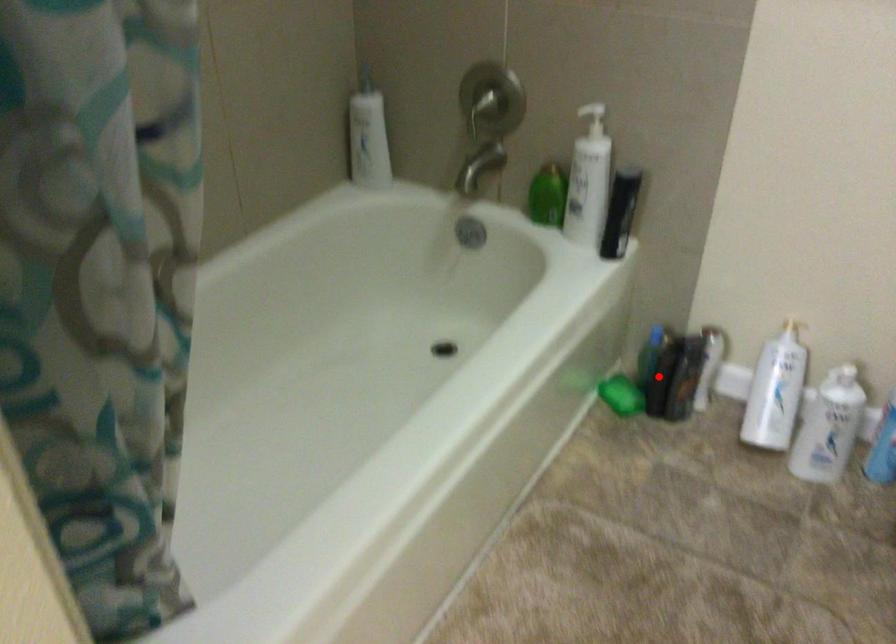
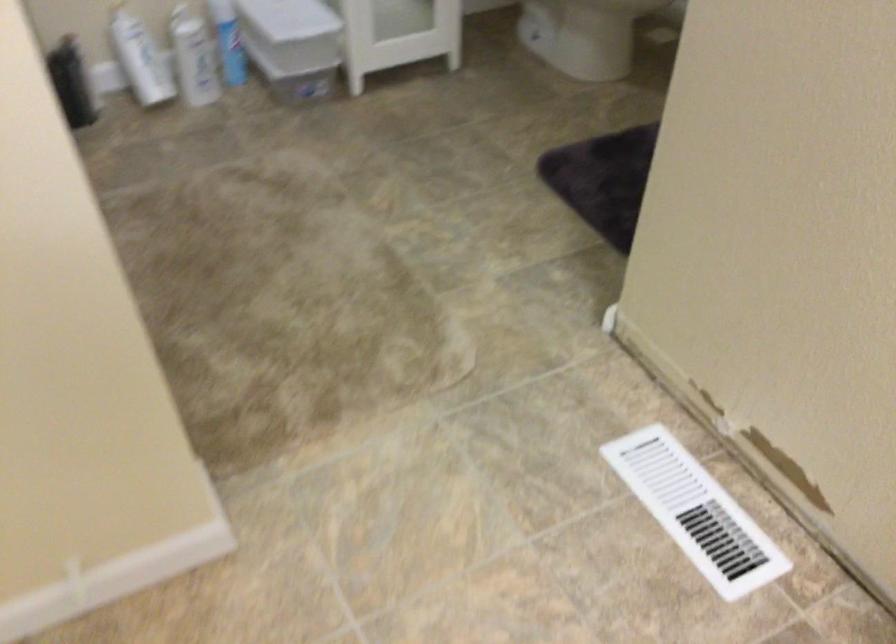
Locate, in the second image, the point that corresponds to the highlighted location in the first image.

(72, 82)